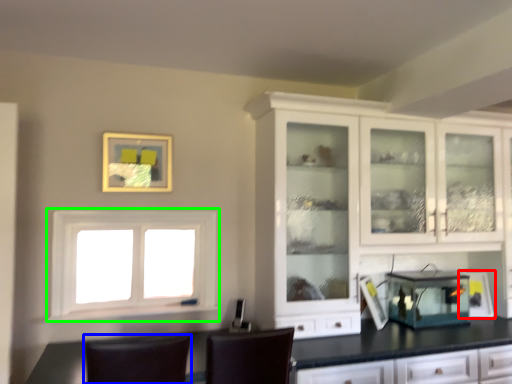
Question: Which is farther away from appliance (highlighted by a red box)? chair (highlighted by a blue box) or window (highlighted by a green box)?

Choices:
 (A) chair
 (B) window

Answer: (B)